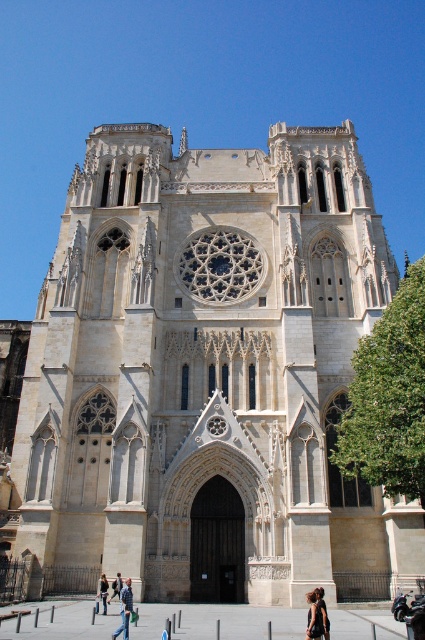
You are standing in front of the Gothic cathedral and notice a person with dark brown hair at lower center and a light brown leather jacket at lower center. Which object is positioned to the right when facing the cathedral?

The dark brown hair at lower center is positioned to the right of the light brown leather jacket at lower center.